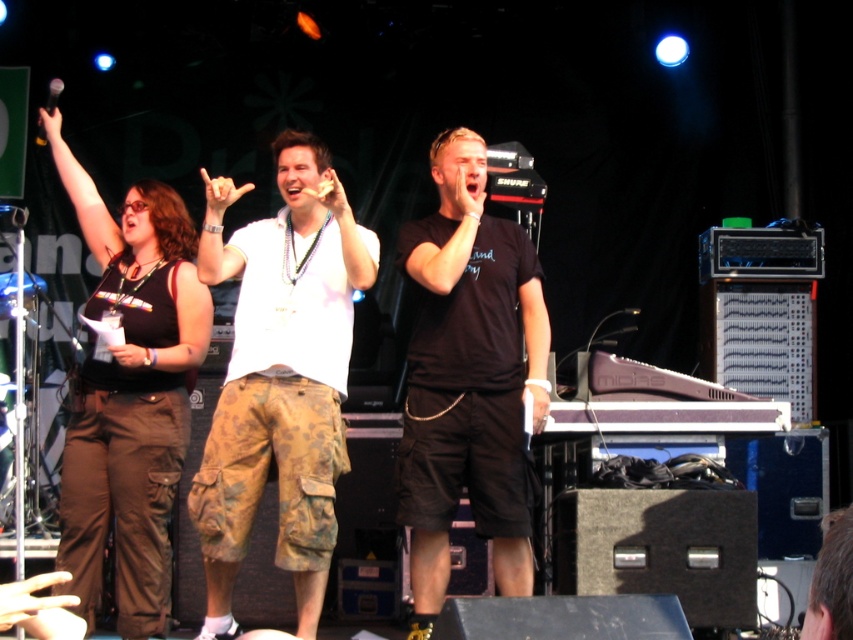
Can you confirm if camo shorts at center is positioned to the left of black cotton t-shirt at center?

Yes, camo shorts at center is to the left of black cotton t-shirt at center.

Does camo shorts at center appear on the right side of black cotton t-shirt at center?

Incorrect, camo shorts at center is not on the right side of black cotton t-shirt at center.

This screenshot has width=853, height=640. Find the location of `camo shorts at center`. camo shorts at center is located at coordinates (280, 376).

Is camo shorts at center to the right of matte black tank top at center from the viewer's perspective?

Correct, you'll find camo shorts at center to the right of matte black tank top at center.

Which is below, camo shorts at center or matte black tank top at center?

camo shorts at center is lower down.

Is point (248, 404) behind point (115, 365)?

No, it is not.

Find the location of `camo shorts at center`. camo shorts at center is located at coordinates (280, 376).

Who is positioned more to the left, camo shorts at center or black matte microphone at upper left?

black matte microphone at upper left

Does point (335, 298) come behind point (51, 109)?

No, it is in front of (51, 109).

Where is `camo shorts at center`? Image resolution: width=853 pixels, height=640 pixels. camo shorts at center is located at coordinates (280, 376).